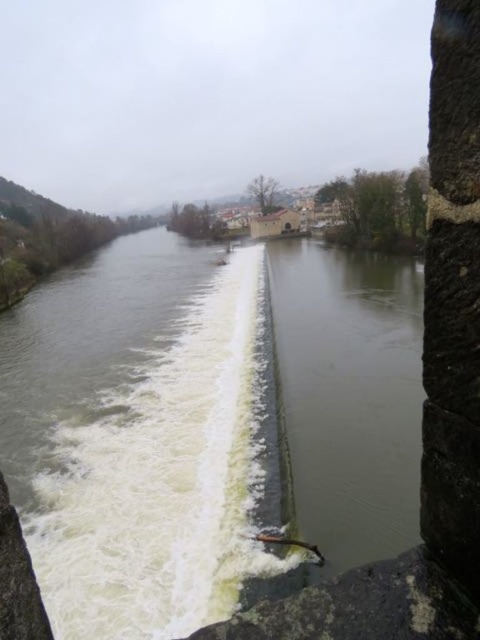
Which is behind, point (163, 253) or point (328, 381)?

The point (163, 253) is more distant.

Consider the image. Does greenish concrete river at center appear over greenish concrete dam at center?

Yes, greenish concrete river at center is above greenish concrete dam at center.

The width and height of the screenshot is (480, 640). I want to click on greenish concrete river at center, so click(x=91, y=403).